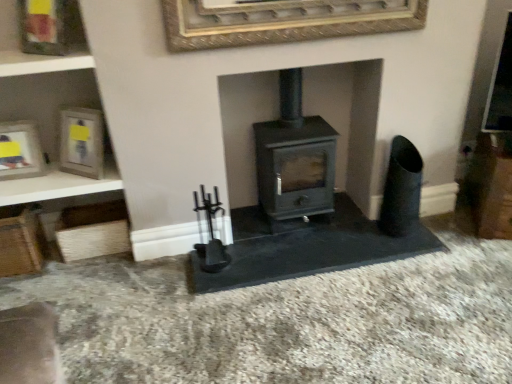
Identify the location of vacant area that lies to the right of matte gray wood burning stove at center. (353, 225).